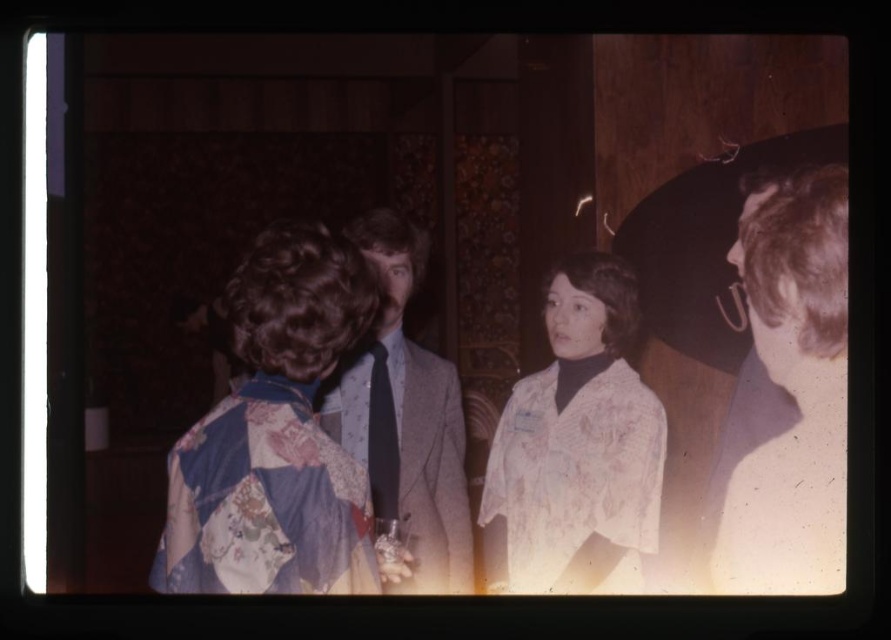
Question: Can you confirm if floral fabric dress at center is bigger than dark blue silk tie at center?

Choices:
 (A) yes
 (B) no

Answer: (A)

Question: Based on their relative distances, which object is nearer to the gray wool suit at center?

Choices:
 (A) floral silk blouse at center
 (B) dark blue silk tie at center
 (C) floral fabric dress at center

Answer: (B)

Question: Among these objects, which one is farthest from the camera?

Choices:
 (A) gray wool suit at center
 (B) floral fabric dress at center
 (C) dark blue silk tie at center
 (D) floral silk blouse at center

Answer: (D)

Question: Does gray wool suit at center appear on the right side of dark blue silk tie at center?

Choices:
 (A) yes
 (B) no

Answer: (A)

Question: Estimate the real-world distances between objects in this image. Which object is farther from the floral fabric dress at center?

Choices:
 (A) dark blue silk tie at center
 (B) floral silk blouse at center

Answer: (B)

Question: In this image, where is floral fabric dress at center located relative to floral silk blouse at center?

Choices:
 (A) above
 (B) below

Answer: (A)